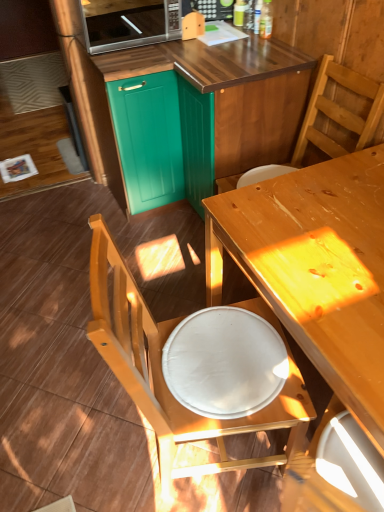
Image resolution: width=384 pixels, height=512 pixels. In order to click on free point below satin silver microwave at upper center (from a real-world perspective) in this screenshot , I will do `click(116, 35)`.